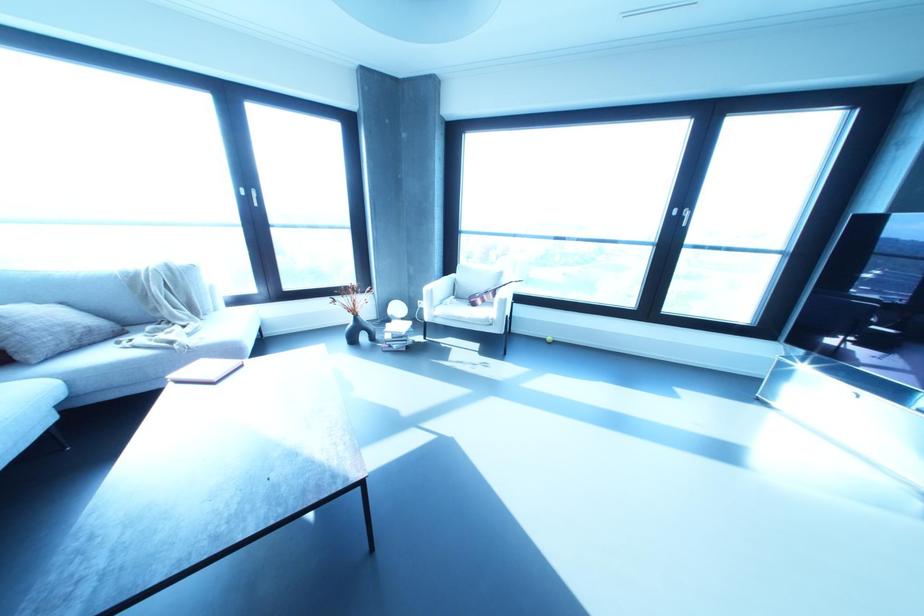
The image size is (924, 616). Find the location of `white chair sitting surface`. white chair sitting surface is located at coordinates (464, 307).